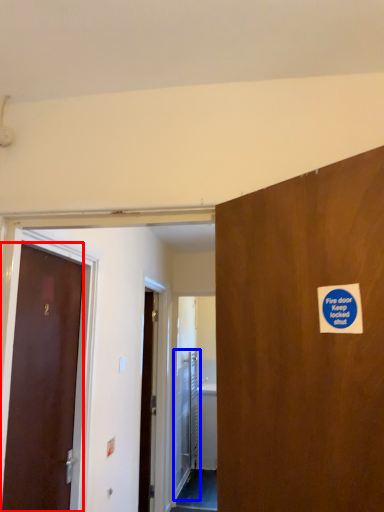
Question: Which object is closer to the camera taking this photo, door (highlighted by a red box) or elevator door (highlighted by a blue box)?

Choices:
 (A) door
 (B) elevator door

Answer: (A)